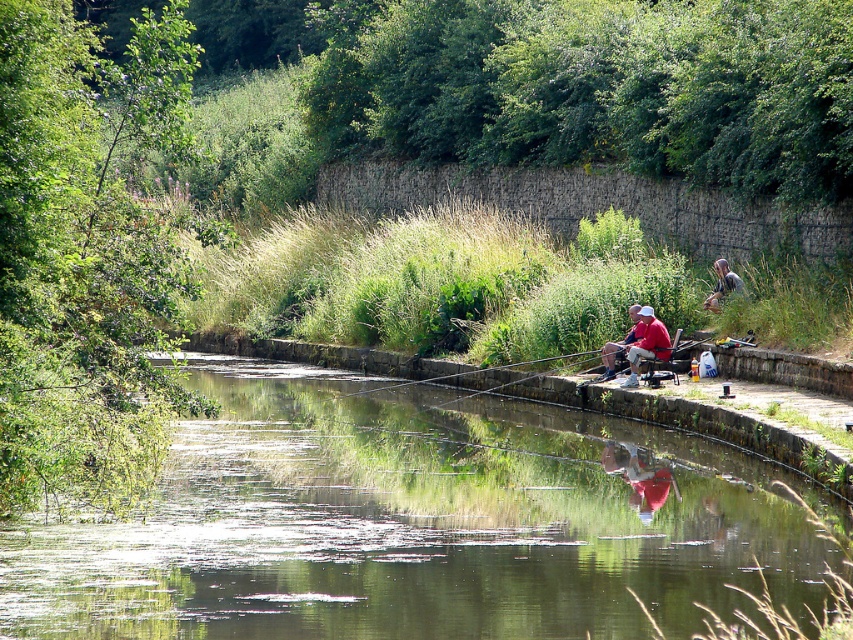
Question: Which is nearer to the matte red shirt at center?

Choices:
 (A) green grassy stream at center
 (B) camouflage fabric person at right
 (C) red fabric shirt at center
 (D) smooth wooden rod at center

Answer: (C)

Question: Does red fabric shirt at center have a lesser width compared to matte red shirt at center?

Choices:
 (A) yes
 (B) no

Answer: (A)

Question: Can you confirm if green grassy stream at center is smaller than red fabric shirt at center?

Choices:
 (A) yes
 (B) no

Answer: (B)

Question: Which object appears closest to the camera in this image?

Choices:
 (A) red fabric shirt at center
 (B) matte red shirt at center
 (C) camouflage fabric person at right
 (D) green grassy stream at center

Answer: (D)

Question: Considering the real-world distances, which object is closest to the matte red shirt at center?

Choices:
 (A) smooth wooden rod at center
 (B) camouflage fabric person at right
 (C) red fabric shirt at center
 (D) green grassy stream at center

Answer: (C)

Question: Does red fabric shirt at center have a greater width compared to smooth wooden rod at center?

Choices:
 (A) yes
 (B) no

Answer: (B)